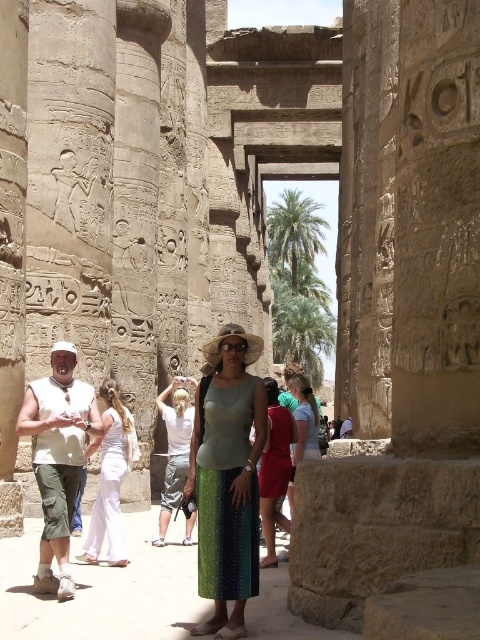
In the scene shown: Does white cotton vest at left appear on the right side of white cotton dress at left?

In fact, white cotton vest at left is to the left of white cotton dress at left.

Is point (44, 440) less distant than point (99, 438)?

Yes, it is in front of point (99, 438).

Is point (48, 532) farther from camera compared to point (95, 540)?

No, (48, 532) is closer to viewer.

You are a GUI agent. You are given a task and a screenshot of the screen. Output one action in this format:
    pyautogui.click(x=<x>, y=<y>)
    Task: Click on the white cotton vest at left
    This screenshot has width=480, height=640.
    Given the screenshot: What is the action you would take?
    pyautogui.click(x=58, y=458)

Is green textured skirt at center shorter than white cotton dress at left?

No, green textured skirt at center is not shorter than white cotton dress at left.

Between green textured skirt at center and white cotton dress at left, which one has less height?

white cotton dress at left

Describe the element at coordinates (228, 477) in the screenshot. I see `green textured skirt at center` at that location.

Locate an element on the screen. The height and width of the screenshot is (640, 480). green textured skirt at center is located at coordinates (228, 477).

Does white cotton vest at left lie behind white cotton shirt at center?

No, it is not.

Does white cotton vest at left have a lesser width compared to white cotton shirt at center?

No, white cotton vest at left is not thinner than white cotton shirt at center.

Is point (67, 484) less distant than point (173, 435)?

Yes, point (67, 484) is in front of point (173, 435).

Find the location of a particular element. white cotton vest at left is located at coordinates (58, 458).